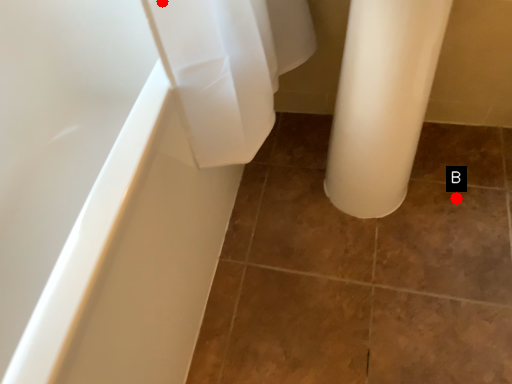
Question: Two points are circled on the image, labeled by A and B beside each circle. Which point appears farthest from the camera in this image?

Choices:
 (A) A is further
 (B) B is further

Answer: (B)